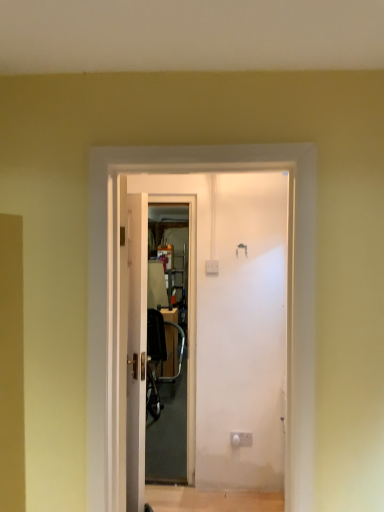
Question: Does transparent plastic screen door at center have a smaller size compared to metallic silver chair at center?

Choices:
 (A) yes
 (B) no

Answer: (A)

Question: Is transparent plastic screen door at center positioned with its back to metallic silver chair at center?

Choices:
 (A) no
 (B) yes

Answer: (A)

Question: Is transparent plastic screen door at center oriented towards metallic silver chair at center?

Choices:
 (A) yes
 (B) no

Answer: (B)

Question: Considering the relative positions of transparent plastic screen door at center and metallic silver chair at center in the image provided, is transparent plastic screen door at center behind metallic silver chair at center?

Choices:
 (A) yes
 (B) no

Answer: (B)

Question: Would you say transparent plastic screen door at center is a long distance from metallic silver chair at center?

Choices:
 (A) yes
 (B) no

Answer: (B)

Question: Is transparent plastic screen door at center wider than metallic silver chair at center?

Choices:
 (A) yes
 (B) no

Answer: (B)

Question: Does white glossy door at center appear on the left side of metallic silver chair at center?

Choices:
 (A) yes
 (B) no

Answer: (A)

Question: Does white glossy door at center have a larger size compared to metallic silver chair at center?

Choices:
 (A) no
 (B) yes

Answer: (A)

Question: Is white glossy door at center smaller than metallic silver chair at center?

Choices:
 (A) yes
 (B) no

Answer: (A)

Question: Does white glossy door at center have a lesser width compared to metallic silver chair at center?

Choices:
 (A) yes
 (B) no

Answer: (A)

Question: From a real-world perspective, is white glossy door at center beneath metallic silver chair at center?

Choices:
 (A) no
 (B) yes

Answer: (A)

Question: Does white glossy door at center turn towards metallic silver chair at center?

Choices:
 (A) yes
 (B) no

Answer: (B)

Question: Does transparent plastic screen door at center have a lesser height compared to white glossy door at center?

Choices:
 (A) yes
 (B) no

Answer: (B)